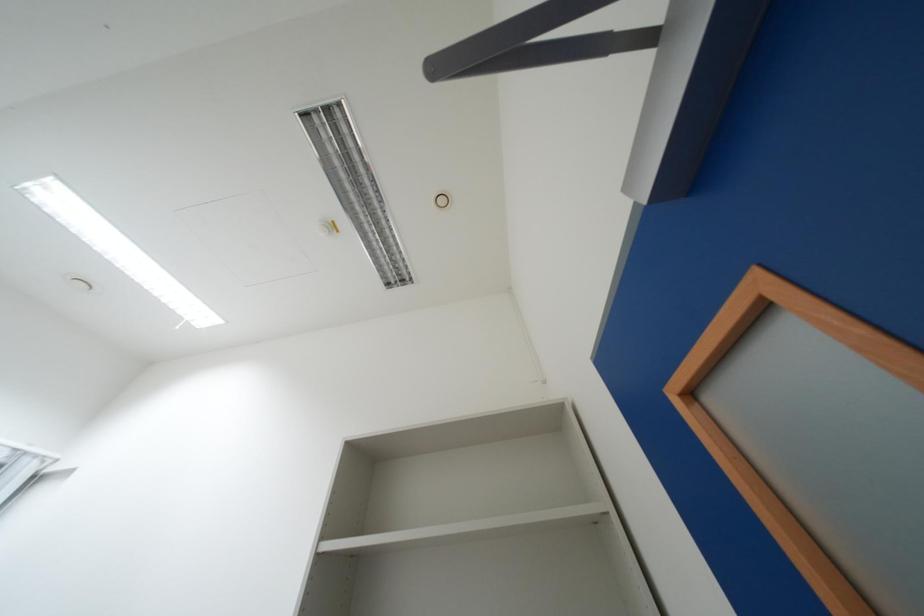
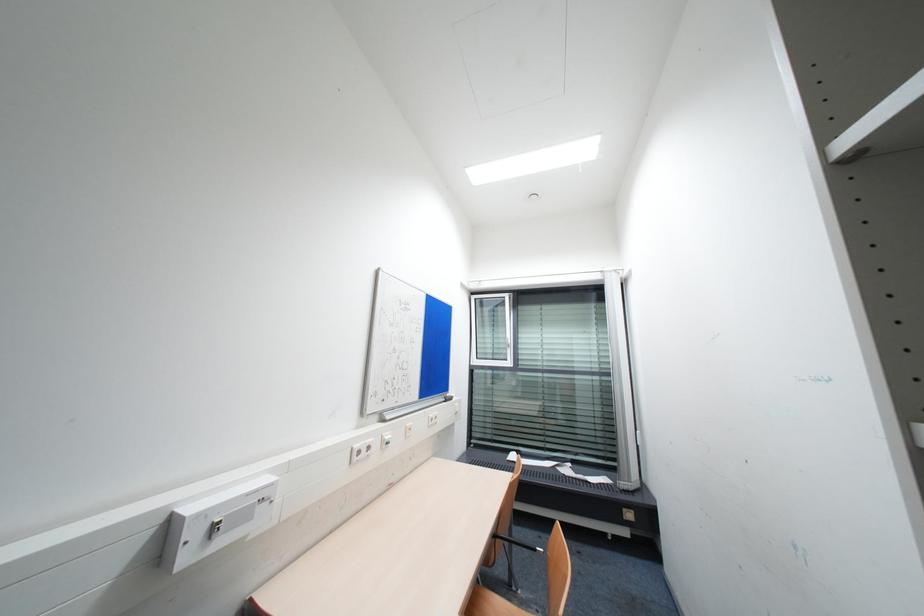
Question: How did the camera likely rotate?

Choices:
 (A) Left
 (B) Right
 (C) Up
 (D) Down

Answer: (A)